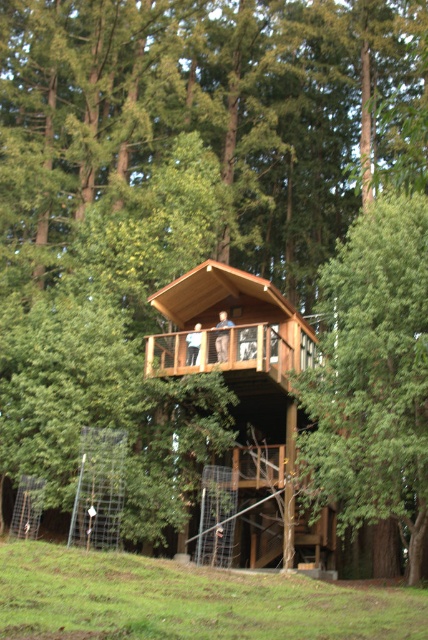
Based on the photo, you are planning to build a new treehouse in the forest. You want to ensure that the new treehouse will have a clear view of the sky without any obstruction from the green leafy tree at center. Based on the information provided, will the wooden cabin at center block the view of the sky from the balcony? Please explain your reasoning.

The green leafy tree at center is taller than the wooden cabin at center. Since the tree is taller, it would likely block the view of the sky from the balcony, not the wooden cabin. Therefore, the wooden cabin at center will not block the view of the sky from the balcony, but the green leafy tree at center might obstruct it.

You are standing at the camera position looking at the treehouse. There is a point marked at coordinates point (359, 301). If you want to throw a ball to that point, will it land there if you aim directly at it?

The point (359, 301) is 22.85 meters away from the camera. If you aim directly at it, the ball should land there assuming no external factors like wind interfere.

You are planning to build a new treehouse in the forest. You have two options for the main structure material between the green leafy tree at center and the wooden cabin at center. Which material has a wider width according to the scene?

The wooden cabin at center has a greater width than the green leafy tree at center.